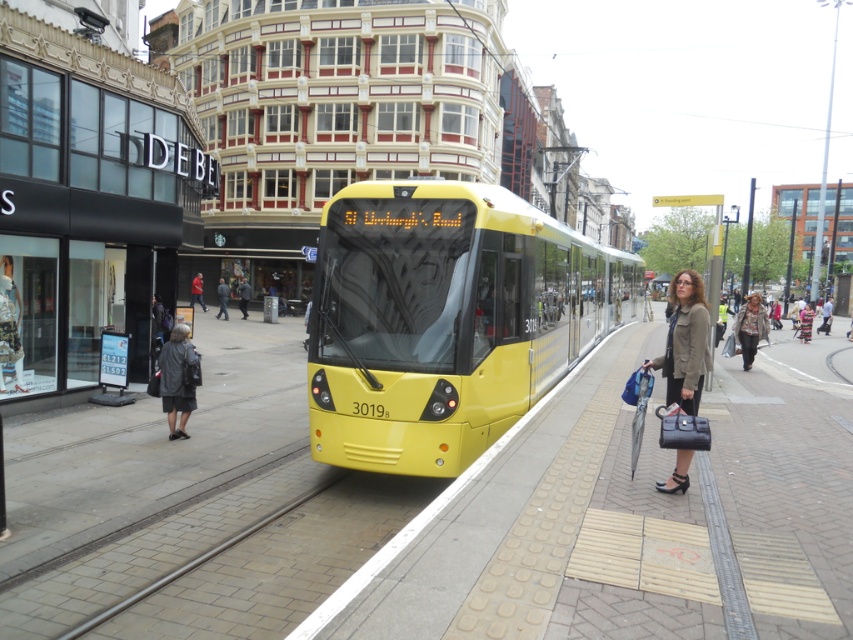
Is dark gray jacket at left below red leather jacket at center?

Indeed, dark gray jacket at left is positioned under red leather jacket at center.

Which is more to the right, dark gray jacket at left or red leather jacket at center?

Positioned to the right is dark gray jacket at left.

Between point (198, 364) and point (193, 291), which one is positioned behind?

The point (193, 291) is behind.

You are a GUI agent. You are given a task and a screenshot of the screen. Output one action in this format:
    pyautogui.click(x=<x>, y=<y>)
    Task: Click on the dark gray jacket at left
    
    Given the screenshot: What is the action you would take?
    pyautogui.click(x=178, y=378)

Is dark gray jacket at left bigger than dark gray jacket at center?

Incorrect, dark gray jacket at left is not larger than dark gray jacket at center.

Is dark gray jacket at left smaller than dark gray jacket at center?

Indeed, dark gray jacket at left has a smaller size compared to dark gray jacket at center.

Locate an element on the screen. The height and width of the screenshot is (640, 853). dark gray jacket at left is located at coordinates (178, 378).

Which is more to the right, leather jacket at center or dark gray jacket at center?

leather jacket at center

Between leather jacket at center and dark gray jacket at center, which one appears on the left side from the viewer's perspective?

From the viewer's perspective, dark gray jacket at center appears more on the left side.

You are a GUI agent. You are given a task and a screenshot of the screen. Output one action in this format:
    pyautogui.click(x=<x>, y=<y>)
    Task: Click on the leather jacket at center
    The width and height of the screenshot is (853, 640).
    Given the screenshot: What is the action you would take?
    pyautogui.click(x=750, y=328)